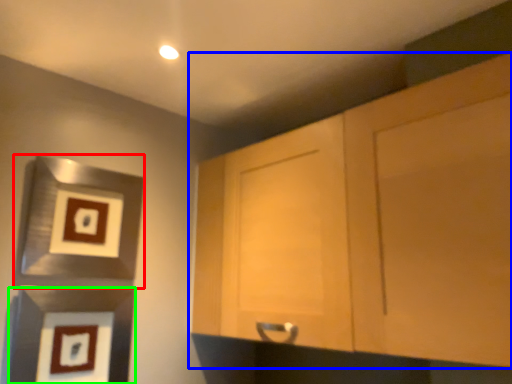
Question: Which object is positioned closest to picture frame (highlighted by a red box)? Select from cabinetry (highlighted by a blue box) and picture frame (highlighted by a green box).

Choices:
 (A) cabinetry
 (B) picture frame

Answer: (B)